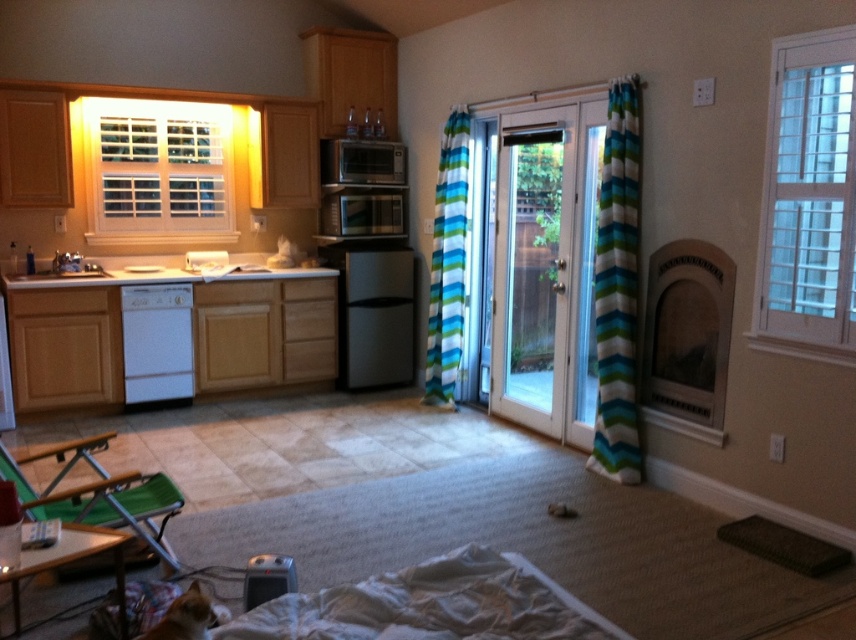
Looking at this image, you are standing in the kitchen and want to reach the satin silver microwave at center to heat up your food. However, there is a striped fabric curtain at center in the way. Can you move the curtain to access the microwave?

The striped fabric curtain at center is closer to the viewer than the satin silver microwave at center, so you can move the curtain to access the microwave.